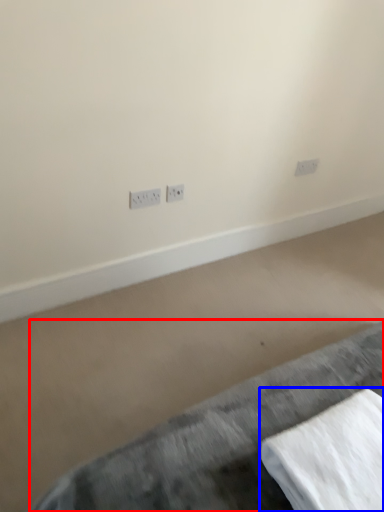
Question: Which object appears farthest to the camera in this image, furniture (highlighted by a red box) or linen (highlighted by a blue box)?

Choices:
 (A) furniture
 (B) linen

Answer: (B)